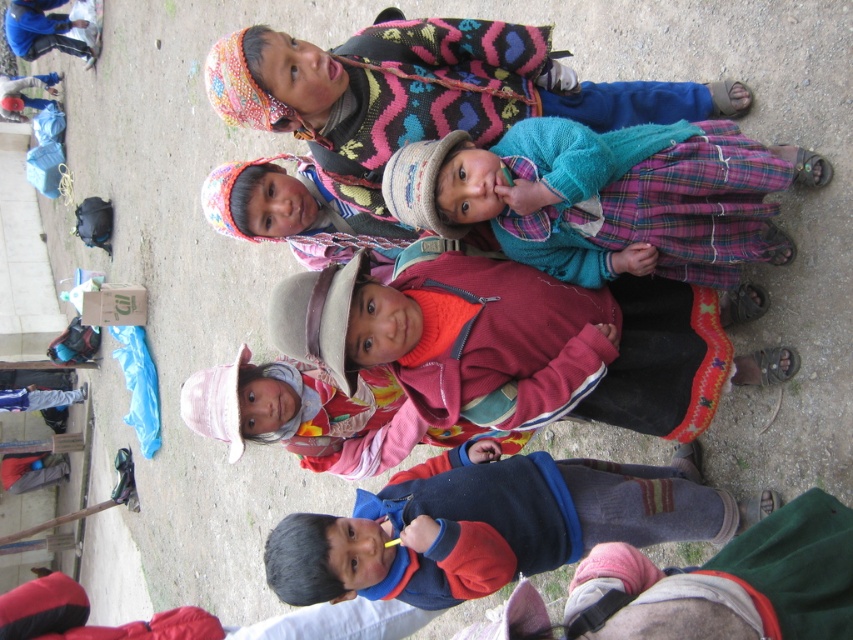
This screenshot has height=640, width=853. What do you see at coordinates (425, 88) in the screenshot?
I see `knitted multicolor sweater at upper center` at bounding box center [425, 88].

Is knitted multicolor sweater at upper center bigger than plaid fabric baby at center?

Yes, knitted multicolor sweater at upper center is bigger than plaid fabric baby at center.

Does point (270, 83) come farther from viewer compared to point (292, 360)?

No, it is in front of (292, 360).

Find the location of a particular element. This screenshot has height=640, width=853. knitted multicolor sweater at upper center is located at coordinates (425, 88).

Can you confirm if knitted wool sweater at center is positioned to the left of knitted multicolor sweater at upper center?

In fact, knitted wool sweater at center is to the right of knitted multicolor sweater at upper center.

Which is more to the left, knitted wool sweater at center or knitted multicolor sweater at upper center?

knitted multicolor sweater at upper center

From the picture: Measure the distance between point (585, 356) and camera.

Point (585, 356) and camera are 5.70 meters apart from each other.

You are a GUI agent. You are given a task and a screenshot of the screen. Output one action in this format:
    pyautogui.click(x=<x>, y=<y>)
    Task: Click on the knitted wool sweater at center
    The image size is (853, 640).
    Given the screenshot: What is the action you would take?
    pyautogui.click(x=514, y=342)

Does plaid fabric baby at center appear on the right side of multicolored woven hat at center?

Yes, plaid fabric baby at center is to the right of multicolored woven hat at center.

Does plaid fabric baby at center appear under multicolored woven hat at center?

Correct, plaid fabric baby at center is located below multicolored woven hat at center.

Is point (375, 384) behind point (293, 204)?

Yes.

Identify the location of plaid fabric baby at center. (317, 416).